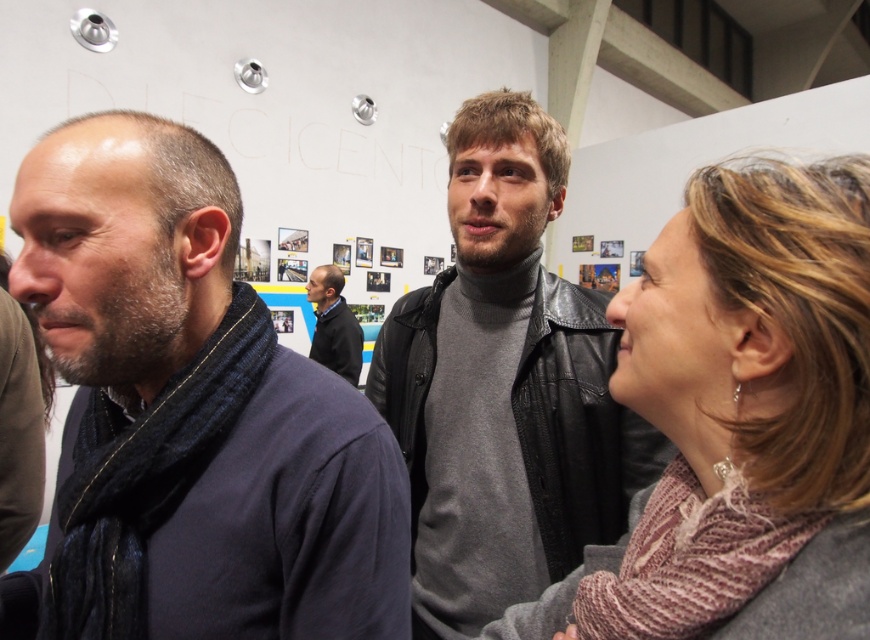
Does point (144, 266) lie in front of point (313, 275)?

Yes.

Locate an element on the screen. The height and width of the screenshot is (640, 870). dark blue scarf at left is located at coordinates (189, 417).

You are a GUI agent. You are given a task and a screenshot of the screen. Output one action in this format:
    pyautogui.click(x=<x>, y=<y>)
    Task: Click on the dark blue scarf at left
    
    Given the screenshot: What is the action you would take?
    pyautogui.click(x=189, y=417)

At what (x,y) coordinates should I click in order to perform the action: click on dark blue scarf at left. Please return your answer as a coordinate pair (x, y). Image resolution: width=870 pixels, height=640 pixels. Looking at the image, I should click on (189, 417).

Is point (305, 368) positioned before point (842, 218)?

No, it is behind (842, 218).

What do you see at coordinates (189, 417) in the screenshot? I see `dark blue scarf at left` at bounding box center [189, 417].

Find the location of `dark blue scarf at left`. dark blue scarf at left is located at coordinates (189, 417).

Is knitted pink sweater at center shorter than leather jacket at center?

Correct, knitted pink sweater at center is not as tall as leather jacket at center.

Is knitted pink sweater at center thinner than leather jacket at center?

Indeed, knitted pink sweater at center has a lesser width compared to leather jacket at center.

Where is `knitted pink sweater at center`? The width and height of the screenshot is (870, 640). knitted pink sweater at center is located at coordinates [748, 412].